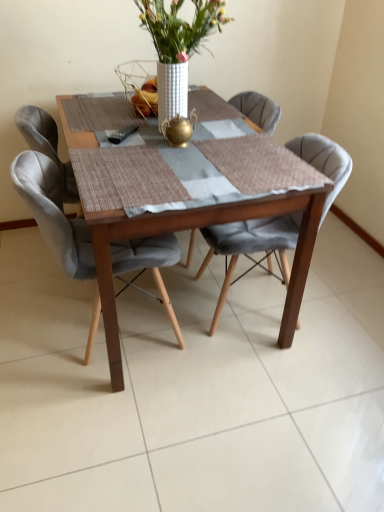
Where is `empty space that is ontop of wooden table at center`? The height and width of the screenshot is (512, 384). empty space that is ontop of wooden table at center is located at coordinates (159, 145).